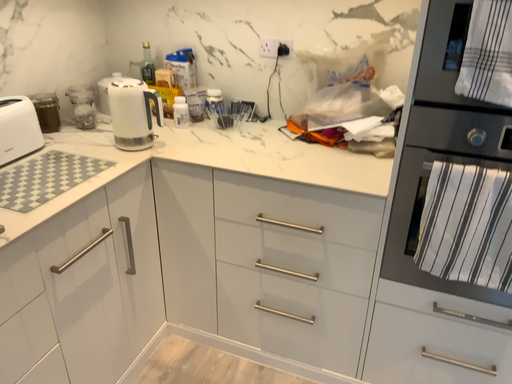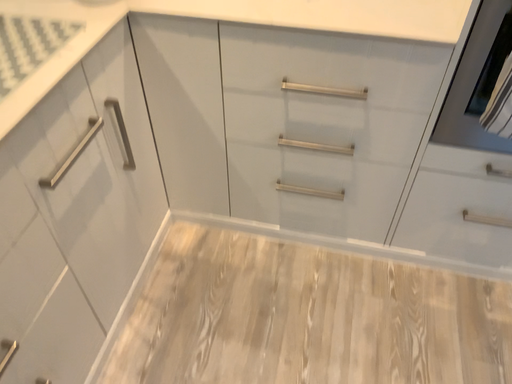
Question: How did the camera likely rotate when shooting the video?

Choices:
 (A) rotated left
 (B) rotated right

Answer: (B)